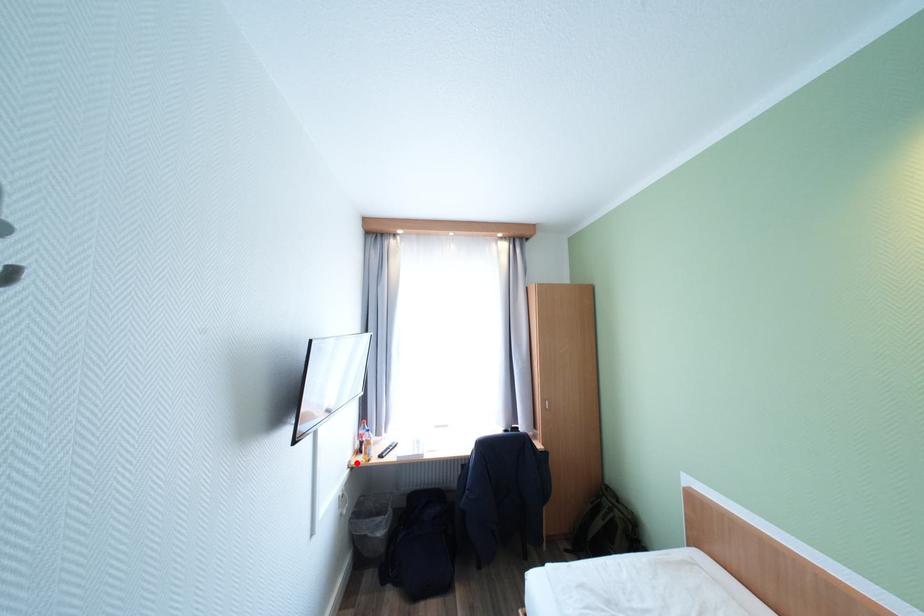
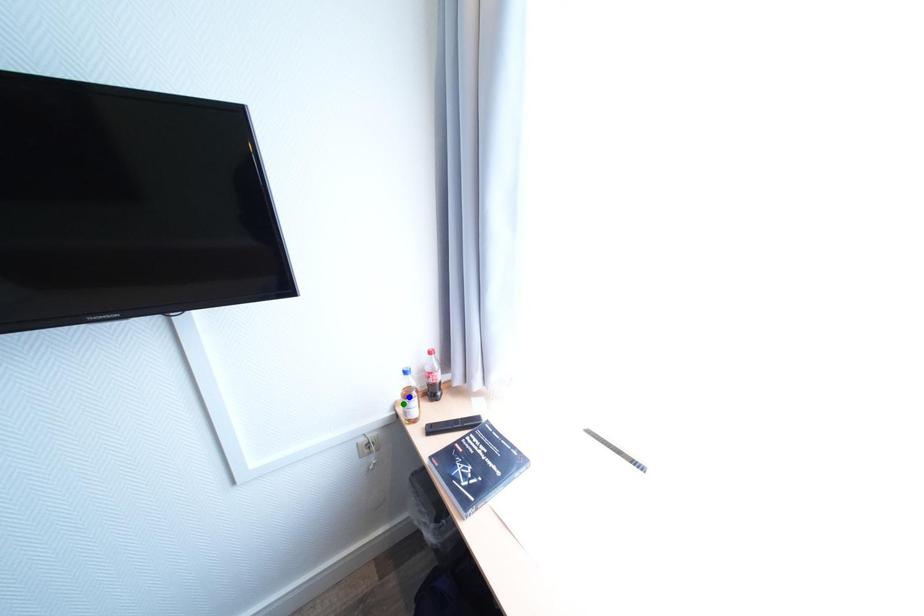
Question: I am providing you with two images of the same scene from different viewpoints. A red point is marked on the first image. You are given multiple points on the second image. Which point in image 2 represents the same 3d spot as the red point in image 1?

Choices:
 (A) green point
 (B) yellow point
 (C) blue point

Answer: (A)